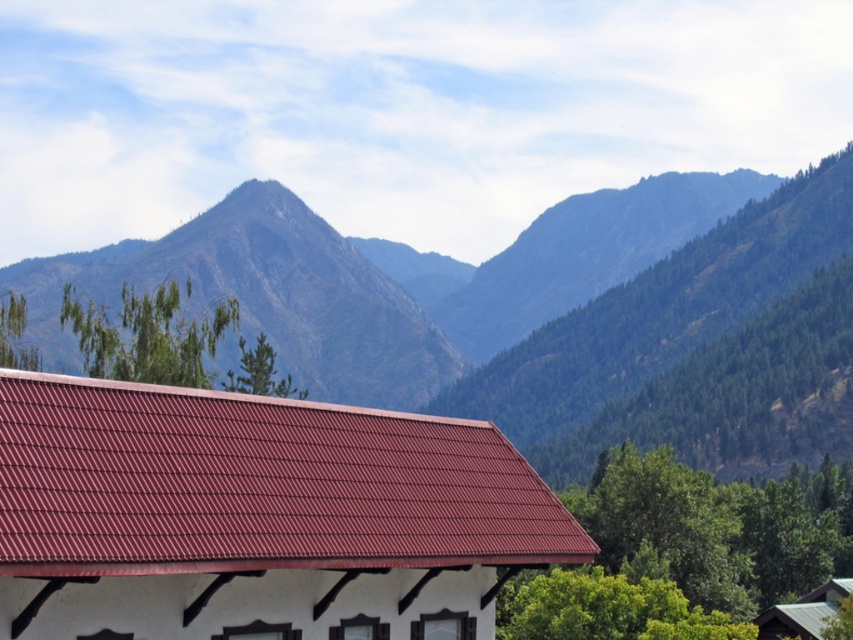
Question: Can you confirm if green textured mountain at upper center is bigger than metallic gray hut at lower right?

Choices:
 (A) no
 (B) yes

Answer: (B)

Question: Which point is farther to the camera?

Choices:
 (A) pos(700,378)
 (B) pos(825,586)

Answer: (A)

Question: Where is rugged granite peak at upper center located in relation to metallic gray hut at lower right in the image?

Choices:
 (A) below
 (B) above

Answer: (B)

Question: Among these points, which one is farthest from the camera?

Choices:
 (A) (784, 195)
 (B) (103, 252)

Answer: (B)

Question: Is green textured mountain at upper center above metallic gray hut at lower right?

Choices:
 (A) no
 (B) yes

Answer: (B)

Question: Among these points, which one is farthest from the camera?

Choices:
 (A) pyautogui.click(x=184, y=531)
 (B) pyautogui.click(x=757, y=298)
 (C) pyautogui.click(x=375, y=388)
 (D) pyautogui.click(x=846, y=588)

Answer: (C)